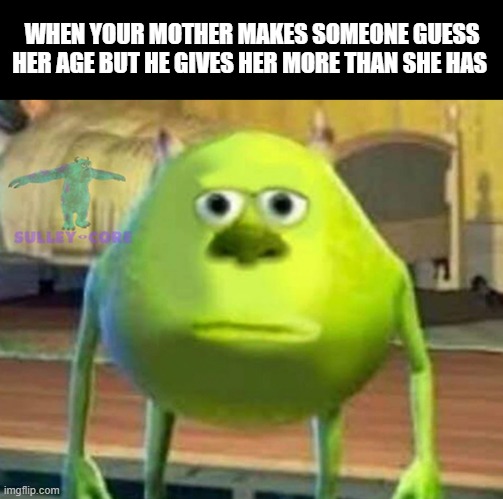
This screenshot has height=499, width=503. Find the location of `floor`. floor is located at coordinates (24, 428), (138, 426), (244, 437), (366, 442), (499, 443).